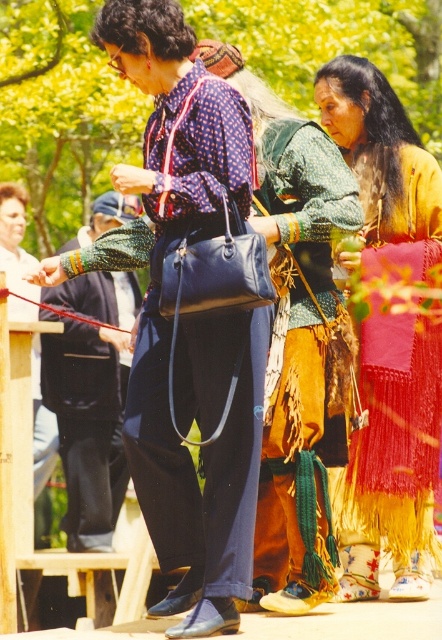
You are standing at the point labeled as point [303,362]. You want to move towards the textured brown leather vest at center. Which direction should you move?

The point [303,362] is the location of the textured brown leather vest at center, so you are already at the correct position.

You are a fashion designer observing the two clothing items worn by the middle person in the scene. The knitted wool skirt at center and the textured brown leather vest at center. How far apart are these two items on the person?

The knitted wool skirt at center is 3.29 feet from the textured brown leather vest at center.

You are standing in the park and see two points marked in the image. The first point is at coordinates point (399, 416) and the second is at point (334, 579). Which point is closer to you?

Point (399, 416) is further to the camera than point (334, 579), so the point closer to you is point (334, 579).